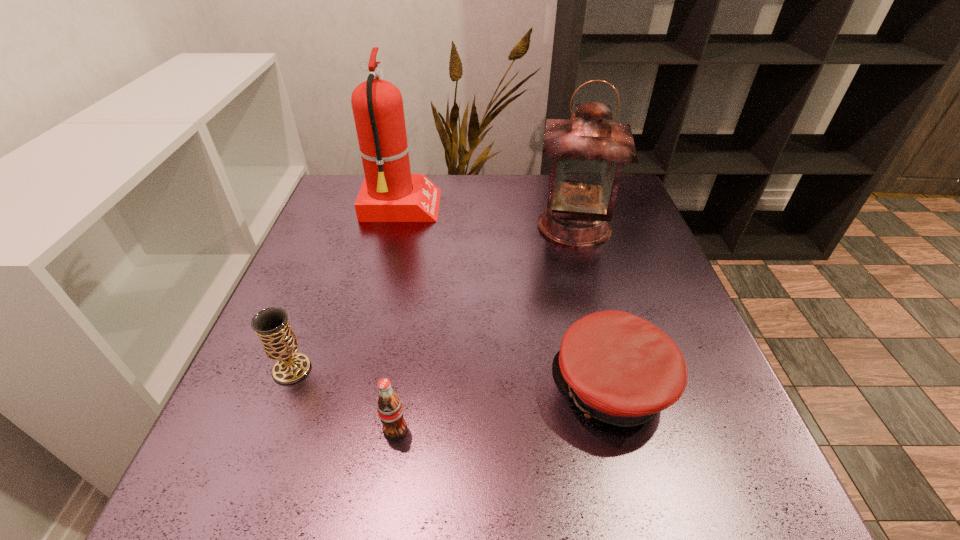
Where is `free region that satisfies the following two spatial constraints: 1. on the front-facing side of the soda; 2. on the right side of the fire extinguisher`? The image size is (960, 540). free region that satisfies the following two spatial constraints: 1. on the front-facing side of the soda; 2. on the right side of the fire extinguisher is located at coordinates tap(348, 430).

Locate an element on the screen. free space that satisfies the following two spatial constraints: 1. on the front-facing side of the soda; 2. on the right side of the fire extinguisher is located at coordinates (348, 430).

You are a GUI agent. You are given a task and a screenshot of the screen. Output one action in this format:
    pyautogui.click(x=<x>, y=<y>)
    Task: Click on the free location that satisfies the following two spatial constraints: 1. on the back side of the oil lamp; 2. on the front-facing side of the fire extinguisher
    The height and width of the screenshot is (540, 960).
    Given the screenshot: What is the action you would take?
    pyautogui.click(x=569, y=207)